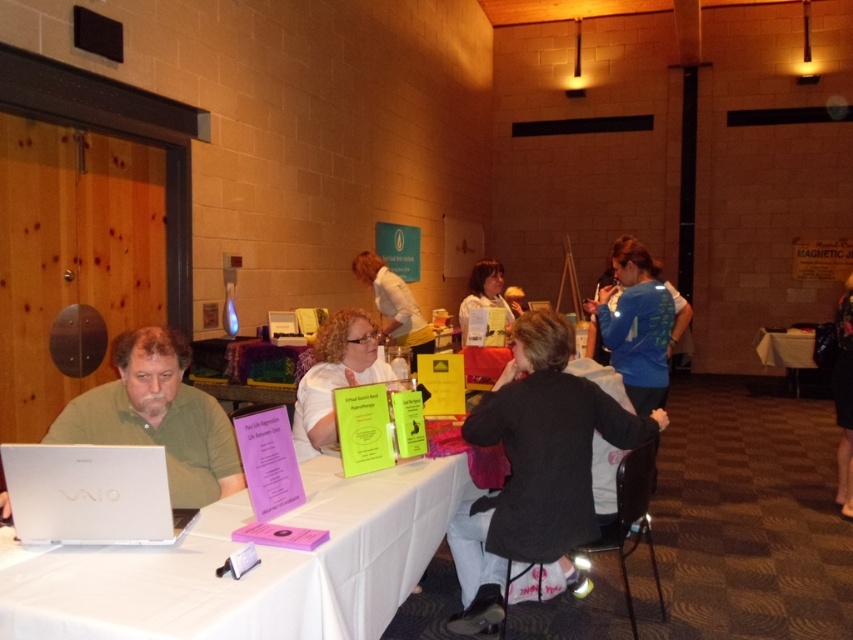
Question: Can you confirm if white cloth-covered table at center is positioned to the right of blue fleece jacket at upper right?

Choices:
 (A) yes
 (B) no

Answer: (B)

Question: Which point is closer to the camera?

Choices:
 (A) white cloth-covered table at center
 (B) matte white shirt at center
 (C) curly blonde hair at center
 (D) black matte jacket at center

Answer: (A)

Question: Does curly blonde hair at center come in front of matte white shirt at center?

Choices:
 (A) no
 (B) yes

Answer: (B)

Question: Can you confirm if silver metallic laptop at left is positioned to the right of white fabric table at right?

Choices:
 (A) yes
 (B) no

Answer: (B)

Question: Which is nearer to the curly blonde hair at center?

Choices:
 (A) green matte laptop at left
 (B) matte white shirt at center

Answer: (A)

Question: Which point appears closest to the camera in this image?

Choices:
 (A) click(x=364, y=269)
 (B) click(x=184, y=518)

Answer: (B)